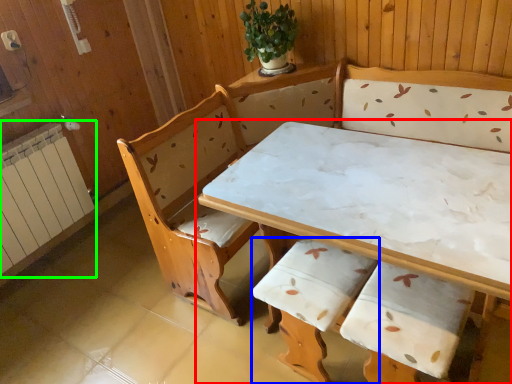
Question: Which is nearer to the table (highlighted by a red box)? armchair (highlighted by a blue box) or radiator (highlighted by a green box).

Choices:
 (A) armchair
 (B) radiator

Answer: (A)